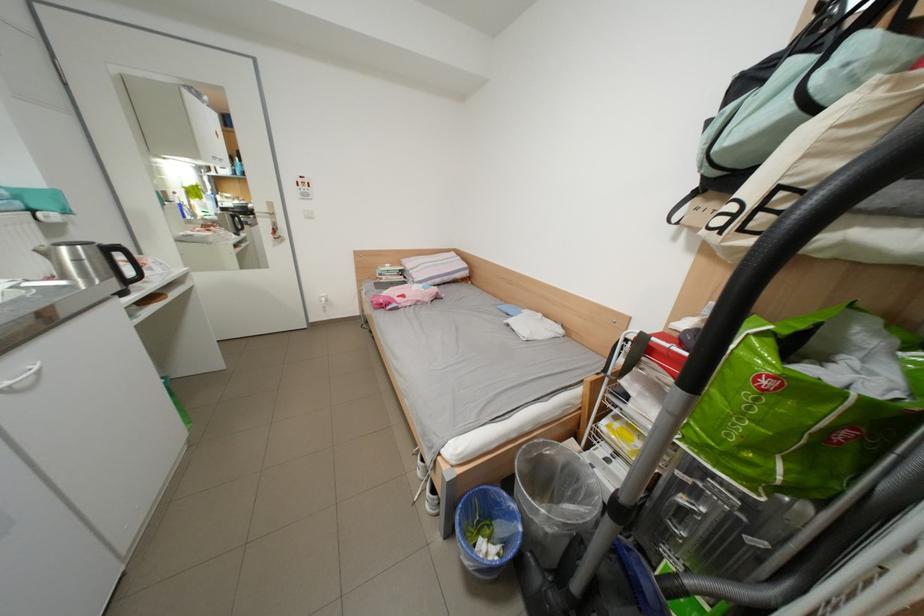
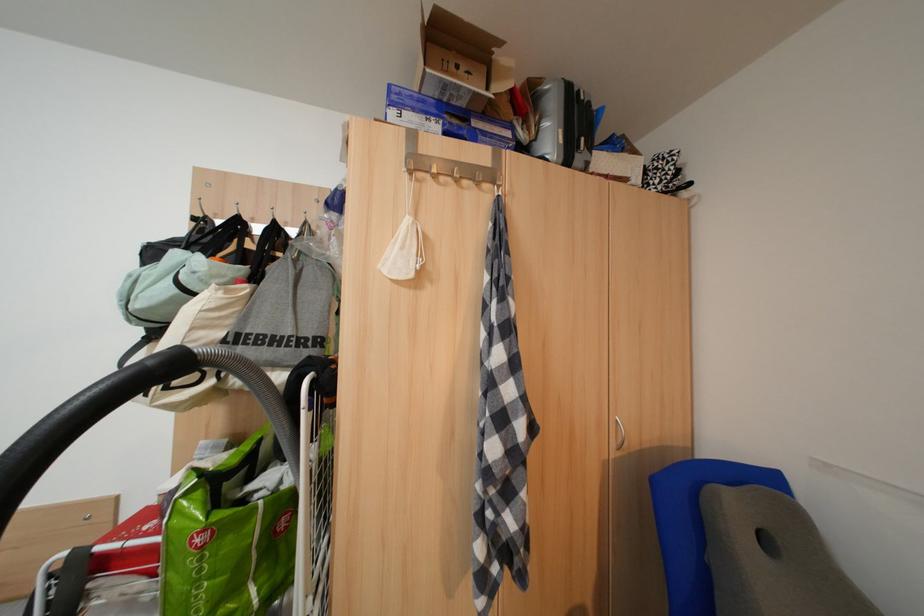
The point at (867, 118) is marked in the first image. Where is the corresponding point in the second image?

(224, 307)